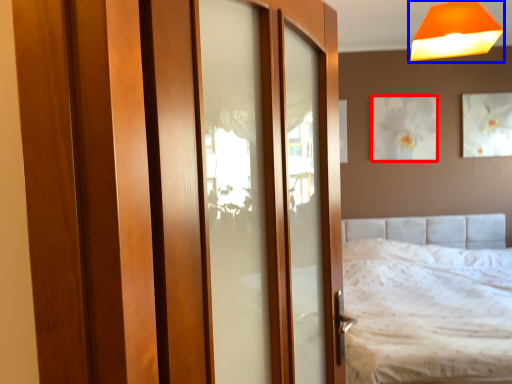
Question: Among these objects, which one is farthest to the camera, picture frame (highlighted by a red box) or lamp (highlighted by a blue box)?

Choices:
 (A) picture frame
 (B) lamp

Answer: (A)